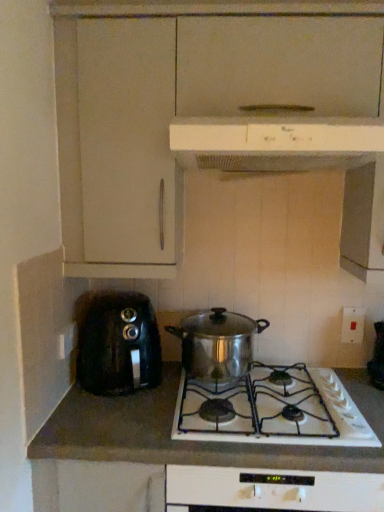
Question: From their relative heights in the image, would you say white plastic range hood at upper center, the second kitchen appliance in the bottom-to-top sequence, is taller or shorter than white plastic electric outlet at lower right, the 2th electric outlet viewed from the right?

Choices:
 (A) short
 (B) tall

Answer: (B)

Question: From a real-world perspective, is white plastic range hood at upper center, arranged as the 1th kitchen appliance when viewed from the top, physically located above or below white plastic electric outlet at lower right, which is the second electric outlet from back to front?

Choices:
 (A) below
 (B) above

Answer: (B)

Question: Estimate the real-world distances between objects in this image. Which object is farther from the black plastic toaster at left?

Choices:
 (A) white plastic range hood at upper center, arranged as the 1th kitchen appliance when viewed from the top
 (B) white glossy stove at center
 (C) white plastic switch at right, the 2th electric outlet viewed from the front
 (D) shiny silver gas stove at center
 (E) stainless steel pot at center, positioned as the second kitchen appliance in top-to-bottom order

Answer: (C)

Question: Considering the real-world distances, which object is farthest from the white plastic electric outlet at lower right, which is counted as the first electric outlet, starting from the front?

Choices:
 (A) white plastic switch at right, the first electric outlet in the right-to-left sequence
 (B) white plastic range hood at upper center, arranged as the 1th kitchen appliance when viewed from the top
 (C) stainless steel pot at center, positioned as the second kitchen appliance in top-to-bottom order
 (D) white glossy stove at center
 (E) black plastic toaster at left

Answer: (A)